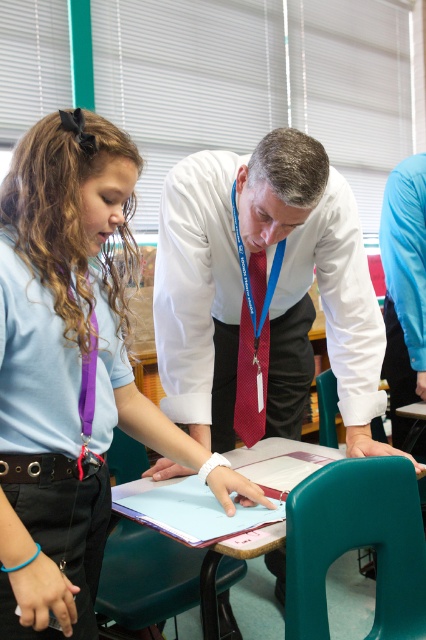
From the picture: Which is below, shiny red tie at center or black leather belt at center?

black leather belt at center is below.

Between point (233, 420) and point (14, 480), which one is positioned behind?

Positioned behind is point (233, 420).

Who is more forward, (x=253, y=276) or (x=89, y=460)?

Point (x=89, y=460)

Locate an element on the screen. This screenshot has width=426, height=640. shiny red tie at center is located at coordinates (253, 356).

Who is positioned more to the right, matte blue shirt at center or shiny red tie at center?

Positioned to the right is shiny red tie at center.

What are the coordinates of `matte blue shirt at center` in the screenshot? It's located at pos(71,368).

Who is positioned more to the right, matte blue shirt at center or black leather belt at center?

matte blue shirt at center

Does matte blue shirt at center have a larger size compared to black leather belt at center?

Correct, matte blue shirt at center is larger in size than black leather belt at center.

Identify the location of matte blue shirt at center. (71, 368).